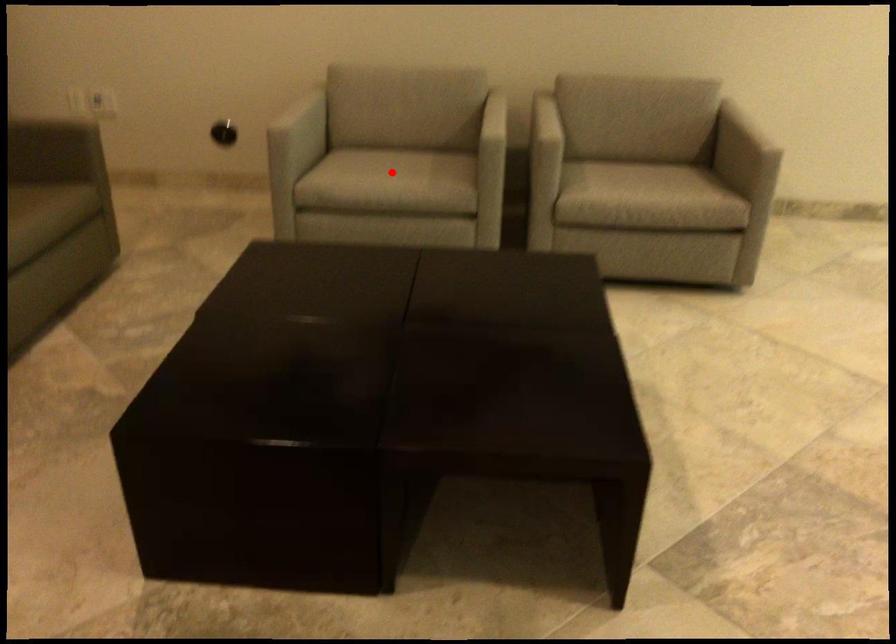
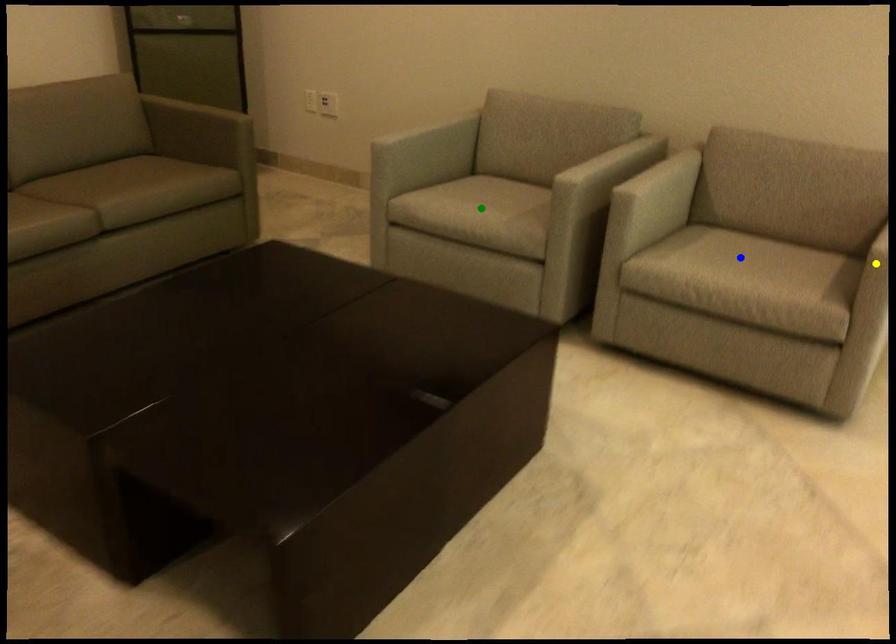
Question: I am providing you with two images of the same scene from different viewpoints. A red point is marked on the first image. You are given multiple points on the second image. Which mark in image 2 goes with the point in image 1?

Choices:
 (A) yellow point
 (B) green point
 (C) blue point

Answer: (B)